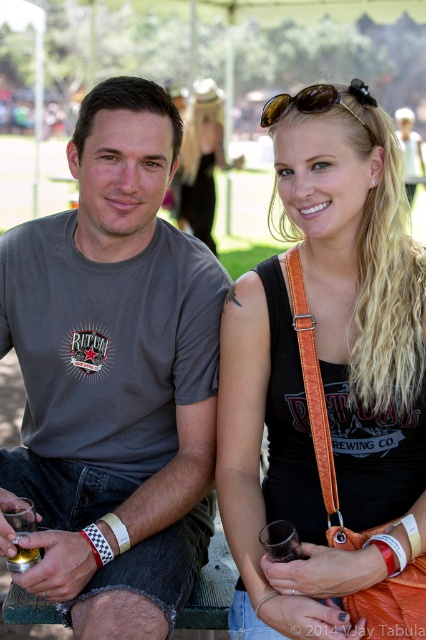
Question: Among these points, which one is farthest from the camera?

Choices:
 (A) (31, 440)
 (B) (305, 349)
 (C) (29, 563)

Answer: (A)

Question: Does orange leather strap at center have a larger size compared to translucent glass at lower left?

Choices:
 (A) no
 (B) yes

Answer: (B)

Question: Does brown matte sunglasses at upper center come in front of translucent glass at lower left?

Choices:
 (A) no
 (B) yes

Answer: (A)

Question: Considering the real-world distances, which object is closest to the brown matte sunglasses at upper center?

Choices:
 (A) gray cotton t-shirt at center
 (B) blonde hair at upper center

Answer: (A)

Question: Considering the real-world distances, which object is closest to the orange leather strap at center?

Choices:
 (A) black leather tank top at upper right
 (B) blonde hair at upper center
 (C) gray cotton t-shirt at center
 (D) brown matte sunglasses at upper center

Answer: (A)

Question: From the image, what is the correct spatial relationship of gray cotton t-shirt at center in relation to blonde hair at upper center?

Choices:
 (A) right
 (B) left

Answer: (B)